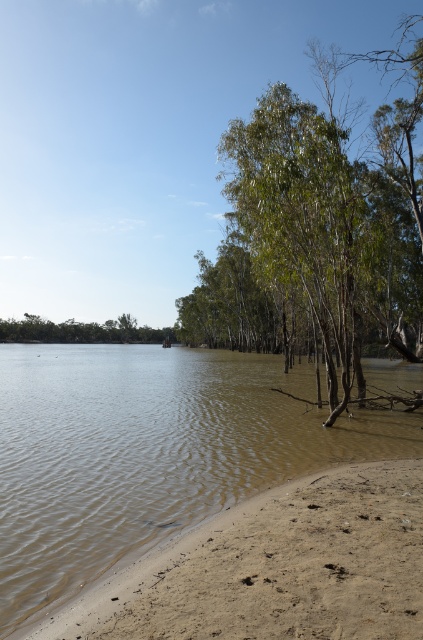
Question: Does brown muddy water at lower left have a lesser width compared to green leafy tree at center?

Choices:
 (A) yes
 (B) no

Answer: (A)

Question: Does brown muddy water at lower left appear on the right side of green leafy tree at center?

Choices:
 (A) yes
 (B) no

Answer: (B)

Question: Which of these objects is positioned closest to the brown muddy water at lower left?

Choices:
 (A) green leafy tree at center
 (B) green leafy tree at lower left

Answer: (A)

Question: Which point appears closest to the camera in this image?

Choices:
 (A) (118, 326)
 (B) (255, 124)
 (C) (164, 419)

Answer: (C)

Question: Which point is closer to the camera?

Choices:
 (A) green leafy tree at center
 (B) brown muddy water at lower left

Answer: (B)

Question: Is brown muddy water at lower left below green leafy tree at center?

Choices:
 (A) yes
 (B) no

Answer: (A)